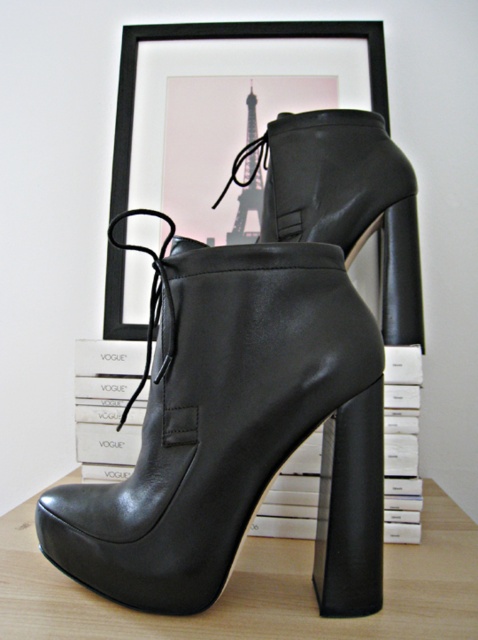
You are organizing a display and need to place a small decorative item between the black leather boot at center and the black matte picture frame at upper center. Based on their positions, where should you position the item?

The black leather boot at center is in front of the black matte picture frame at upper center, so you should place the item between them along the depth axis, positioning it in front of the picture frame and behind the boot to maintain the spatial relationship.

You are standing in front of a wooden surface with a black leather boot at center. You want to place a small decorative item on the wooden surface without blocking the view of the boot. Where should you place the item?

You should place the small decorative item closer to the viewer than the black leather boot at center since it is 19.24 inches away from the viewer, allowing the boot to remain visible.

You are organizing a shoe display in a store. You need to place the black leather boot at center and the black leather platform boot at lower center on a shelf. According to the scene, which boot is placed on top of the other?

The black leather boot at center is positioned over the black leather platform boot at lower center, so the black leather boot at center is placed on top of the black leather platform boot at lower center.